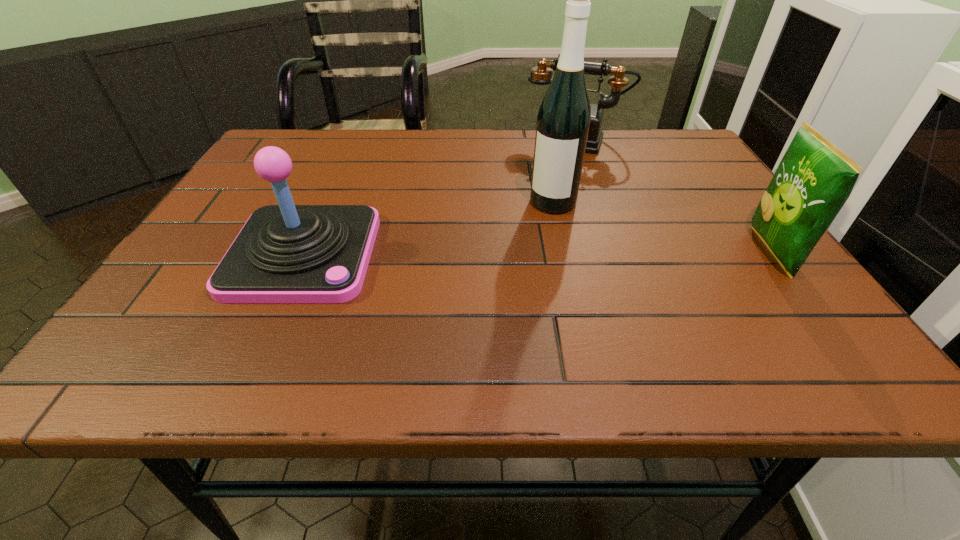
At what (x,y) coordinates should I click in order to perform the action: click on vacant area that lies between the joystick and the farthest object. Please return your answer as a coordinate pair (x, y). Image resolution: width=960 pixels, height=540 pixels. Looking at the image, I should click on pyautogui.click(x=440, y=198).

Locate an element on the screen. free space between the joystick and the crisp (potato chip) is located at coordinates (538, 253).

Locate an element on the screen. The width and height of the screenshot is (960, 540). unoccupied area between the joystick and the crisp (potato chip) is located at coordinates (538, 253).

Identify the location of object that is the closest one to the leftmost object. (563, 120).

Identify which object is the second closest to the tallest object. Please provide its 2D coordinates. Your answer should be formatted as a tuple, i.e. [(x, y)], where the tuple contains the x and y coordinates of a point satisfying the conditions above.

[(286, 253)]

Locate an element on the screen. The image size is (960, 540). vacant region that satisfies the following two spatial constraints: 1. on the front side of the rightmost object; 2. on the front-facing side of the wine bottle is located at coordinates (564, 252).

Identify the location of vacant space that satisfies the following two spatial constraints: 1. on the front side of the telephone; 2. on the front-facing side of the rightmost object. The image size is (960, 540). [x=613, y=252].

You are a GUI agent. You are given a task and a screenshot of the screen. Output one action in this format:
    pyautogui.click(x=<x>, y=<y>)
    Task: Click on the free space that satisfies the following two spatial constraints: 1. on the front side of the crisp (potato chip); 2. on the front-facing side of the wine bottle
    
    Given the screenshot: What is the action you would take?
    pyautogui.click(x=564, y=252)

At what (x,y) coordinates should I click in order to perform the action: click on free space that satisfies the following two spatial constraints: 1. on the front side of the tallest object; 2. on the front-facing side of the rightmost object. Please return your answer as a coordinate pair (x, y). The height and width of the screenshot is (540, 960). Looking at the image, I should click on (564, 252).